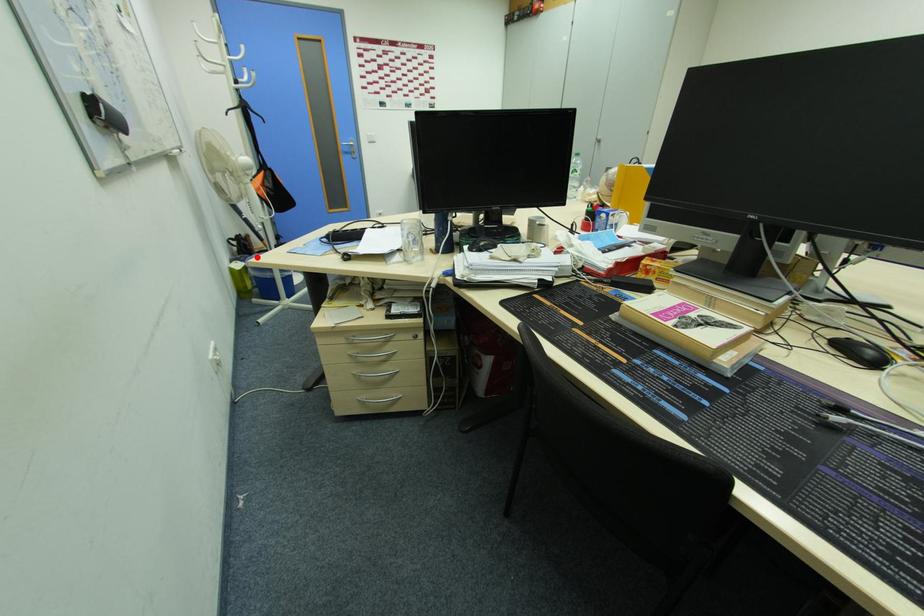
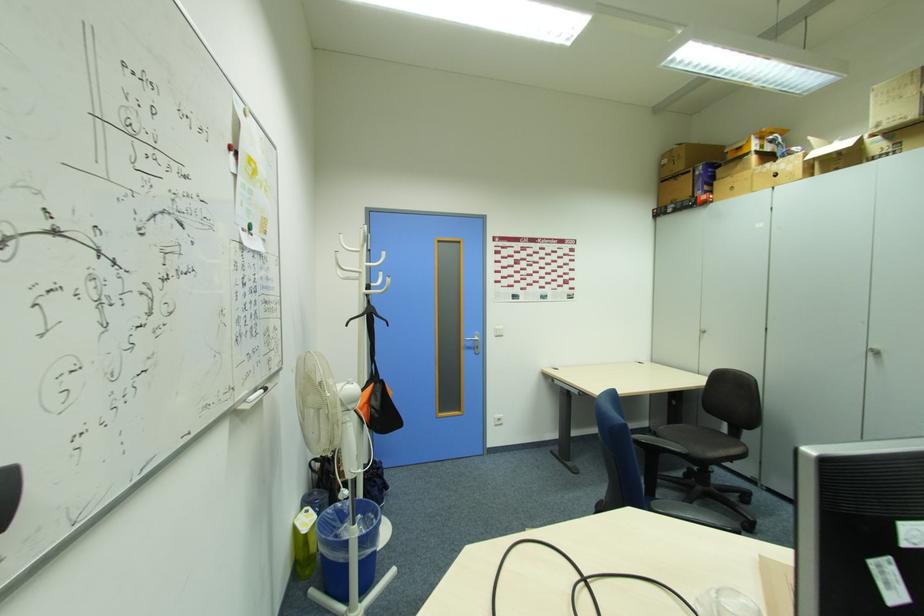
Find the pixel in the second image that matches the highlighted location in the first image.

(334, 512)